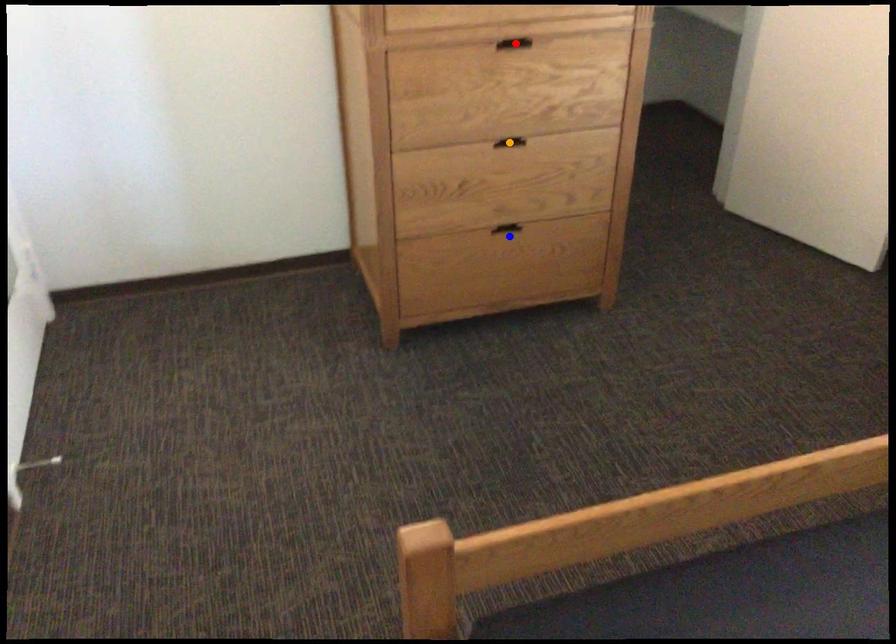
Order these from nearest to farthest:
A) blue point
B) orange point
C) red point

blue point, orange point, red point